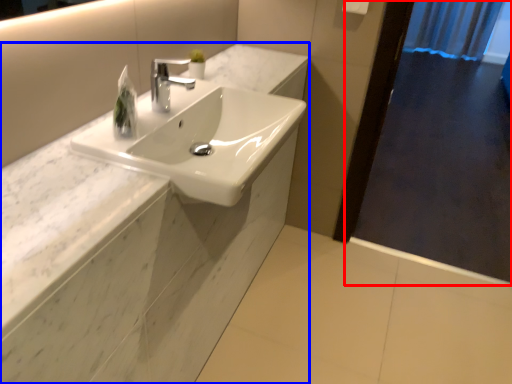
Question: Among these objects, which one is nearest to the camera, screen door (highlighted by a red box) or counter (highlighted by a blue box)?

Choices:
 (A) screen door
 (B) counter

Answer: (B)